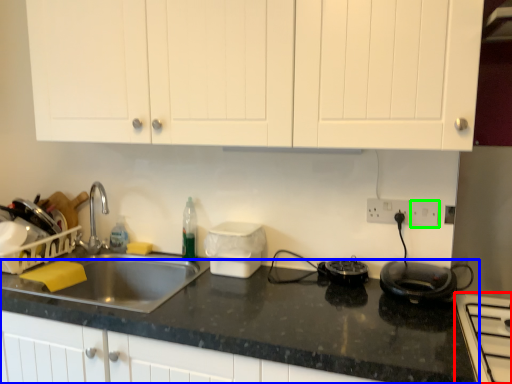
Question: Based on their relative distances, which object is farther from home appliance (highlighted by a red box)? Choose from countertop (highlighted by a blue box) and electric outlet (highlighted by a green box).

Choices:
 (A) countertop
 (B) electric outlet

Answer: (B)